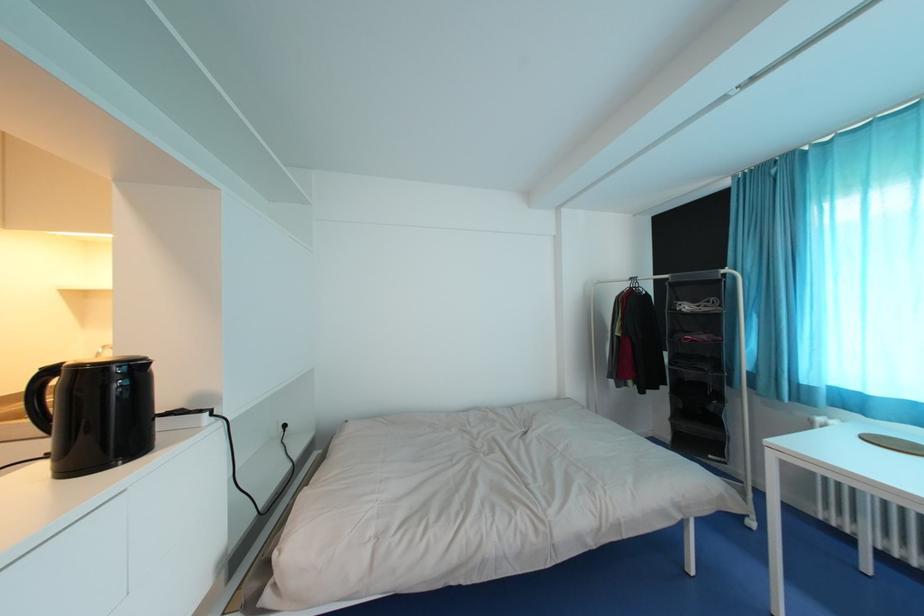
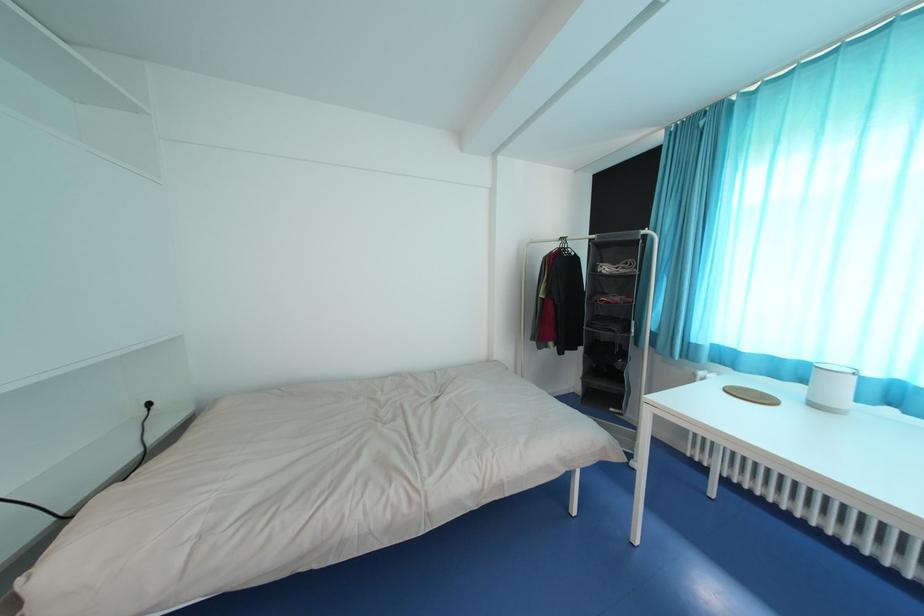
Question: How did the camera likely rotate?

Choices:
 (A) Left
 (B) Right
 (C) Up
 (D) Down

Answer: (D)